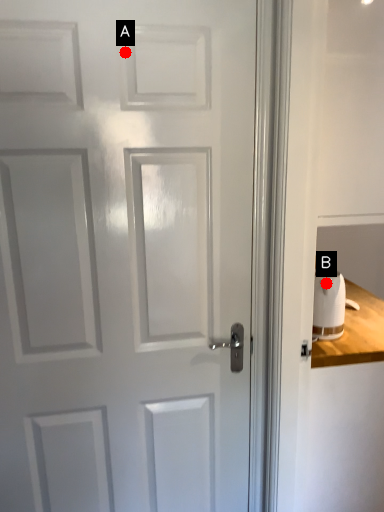
Question: Two points are circled on the image, labeled by A and B beside each circle. Which point is closer to the camera taking this photo?

Choices:
 (A) A is closer
 (B) B is closer

Answer: (A)